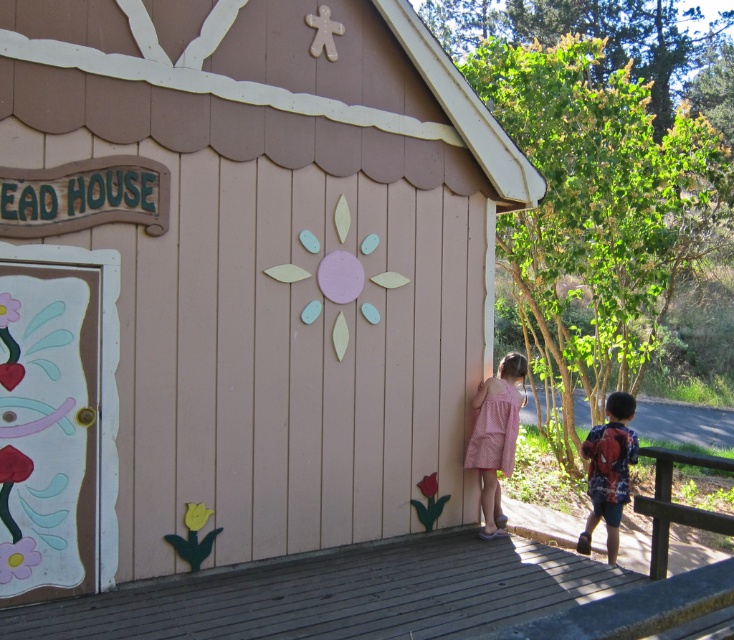
Question: Which of the following is the closest to the observer?

Choices:
 (A) red backpack at lower right
 (B) pink dotted dress at lower right
 (C) wooden hut at center

Answer: (C)

Question: Which of the following is the closest to the observer?

Choices:
 (A) (515, 435)
 (B) (18, 449)

Answer: (B)

Question: Which point is farther from the camera taking this photo?

Choices:
 (A) (606, 516)
 (B) (512, 355)

Answer: (B)

Question: Does pink dotted dress at lower right have a larger size compared to red backpack at lower right?

Choices:
 (A) no
 (B) yes

Answer: (A)

Question: Can you confirm if wooden hut at center is thinner than pink dotted dress at lower right?

Choices:
 (A) no
 (B) yes

Answer: (A)

Question: Does wooden hut at center appear over red backpack at lower right?

Choices:
 (A) no
 (B) yes

Answer: (B)